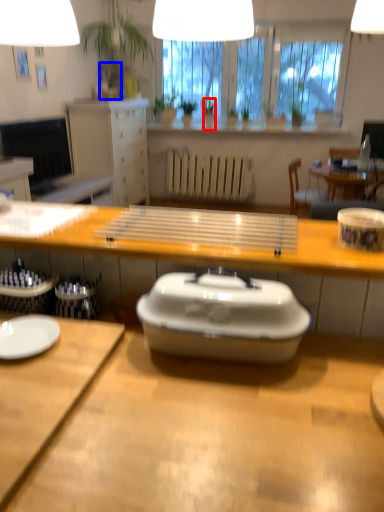
Question: Which object is closer to the camera taking this photo, houseplant (highlighted by a red box) or vase (highlighted by a blue box)?

Choices:
 (A) houseplant
 (B) vase

Answer: (A)